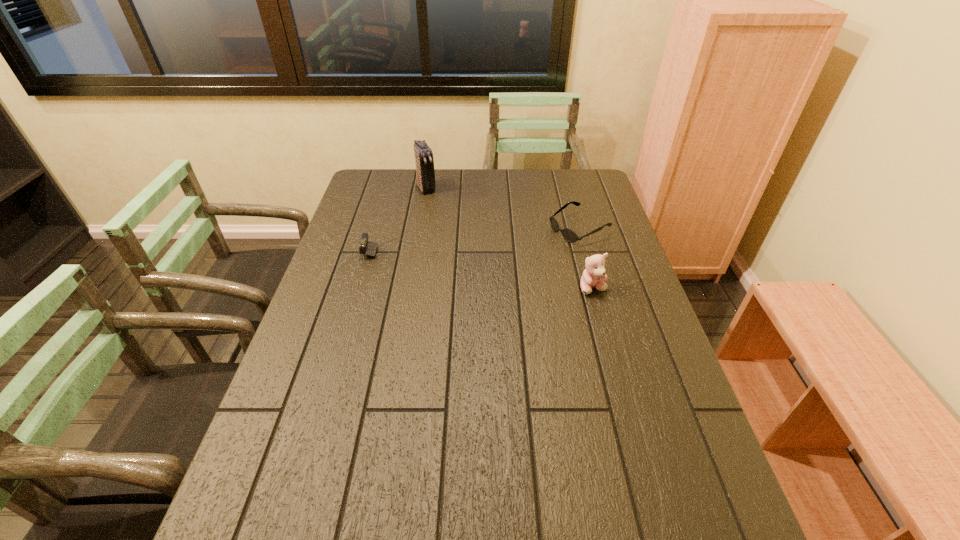
Where is `vacant point located between the sunglasses and the third shortest object`? This screenshot has width=960, height=540. vacant point located between the sunglasses and the third shortest object is located at coordinates (586, 258).

Locate an element on the screen. This screenshot has width=960, height=540. the second closest object relative to the farthest object is located at coordinates (569, 235).

Where is `object identified as the second closest to the third shortest object`? Image resolution: width=960 pixels, height=540 pixels. object identified as the second closest to the third shortest object is located at coordinates (369, 248).